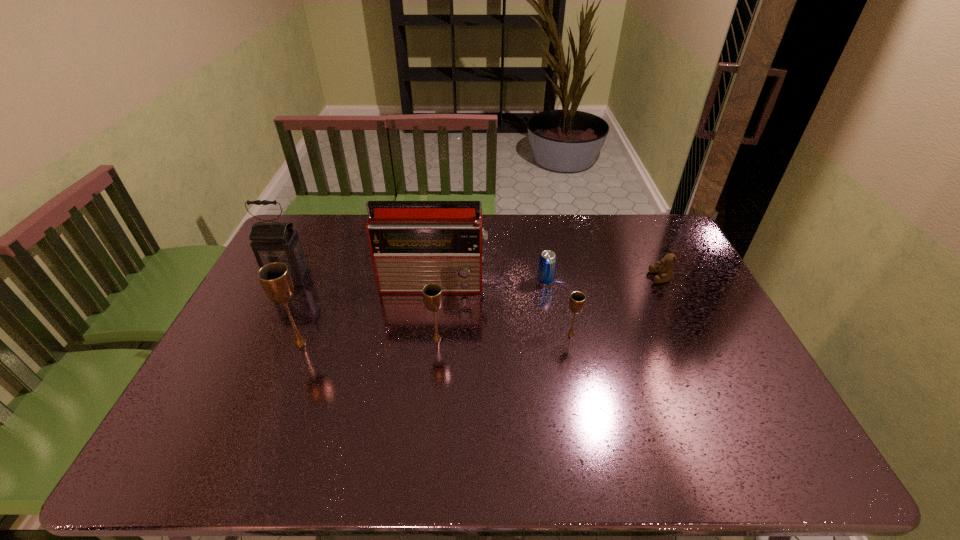
At what (x,y) coordinates should I click in order to perform the action: click on the leftmost chalice. Please return your answer as a coordinate pair (x, y). The width and height of the screenshot is (960, 540). Looking at the image, I should click on (275, 278).

Find the location of `the sixth object from right to left`. the sixth object from right to left is located at coordinates (275, 278).

Locate an element on the screen. This screenshot has height=540, width=960. the fourth shortest object is located at coordinates (432, 293).

Find the location of `the second tallest chalice`. the second tallest chalice is located at coordinates [x=432, y=293].

Identify the location of the third shortest object. This screenshot has height=540, width=960. click(x=577, y=299).

Locate an element on the screen. This screenshot has width=960, height=540. the shortest chalice is located at coordinates (577, 299).

You are a GUI agent. You are given a task and a screenshot of the screen. Output one action in this format:
    pyautogui.click(x=<x>, y=<y>)
    Task: Click on the teddy bear
    
    Given the screenshot: What is the action you would take?
    pyautogui.click(x=665, y=272)

I want to click on radio receiver, so click(413, 243).

The width and height of the screenshot is (960, 540). I want to click on beer can, so click(x=547, y=263).

At what (x,y) coordinates should I click in order to perform the action: click on the leftmost object. Please return your answer as a coordinate pair (x, y). Looking at the image, I should click on (271, 242).